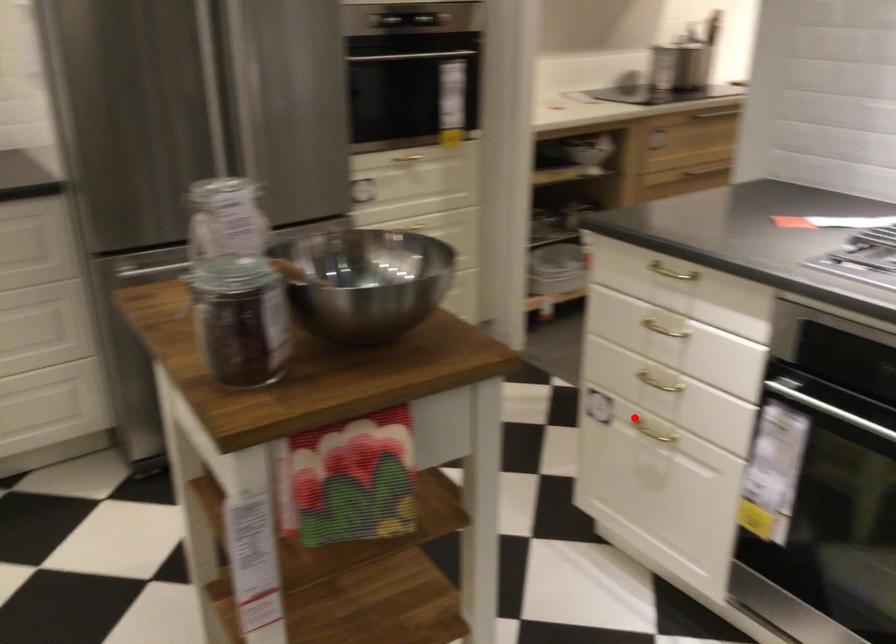
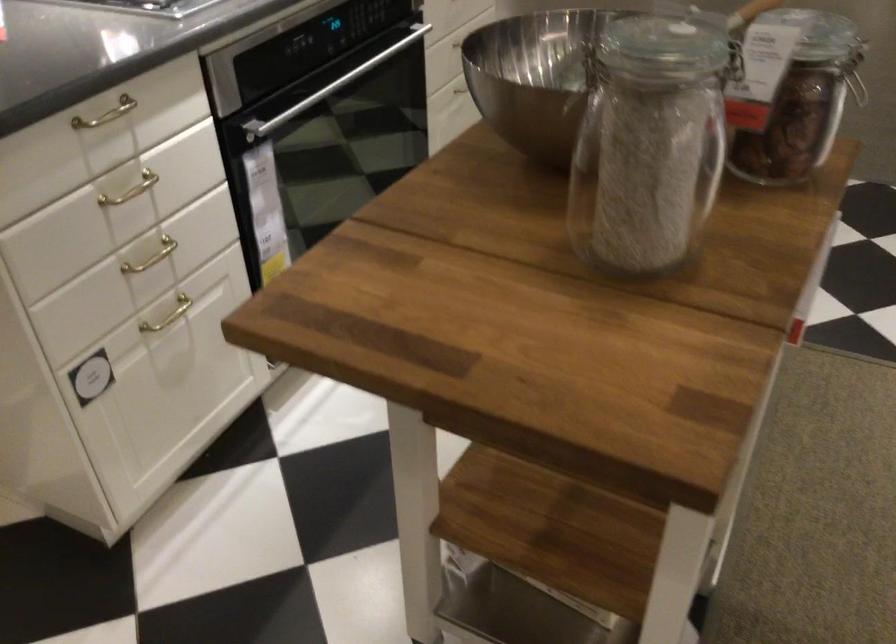
Where in the second image is the point corresponding to the highlighted location from the first image?

(168, 315)